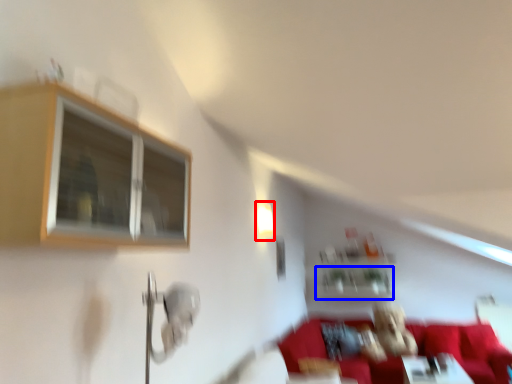
Question: Among these objects, which one is farthest to the camera, light fixture (highlighted by a red box) or shelf (highlighted by a blue box)?

Choices:
 (A) light fixture
 (B) shelf

Answer: (B)